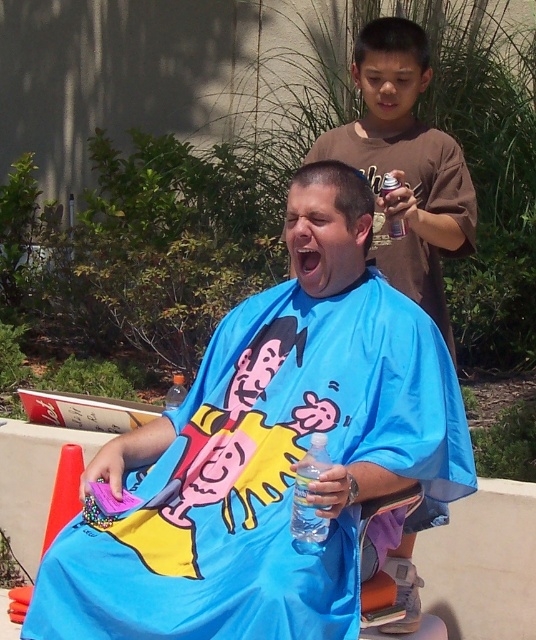
You are a photographer positioned at the center of the scene. You want to take a photo of the blue fabric cape at center and the brown cotton shirt at upper right. Can you fit both objects in the frame if your camera has a 25 inch wide field of view?

The blue fabric cape at center is 25.33 inches away from the brown cotton shirt at upper right, which is slightly wider than the camera field of view of 25 inches. Therefore, it might be challenging to fit both objects in the frame without adjusting the camera angle or zoom.

You are a fashion designer observing the scene. You need to determine which item would require more fabric to produce between the blue fabric cape at center and the brown cotton shirt at upper right. Which one would need more fabric?

The blue fabric cape at center is larger in size than the brown cotton shirt at upper right, so it would require more fabric to produce.